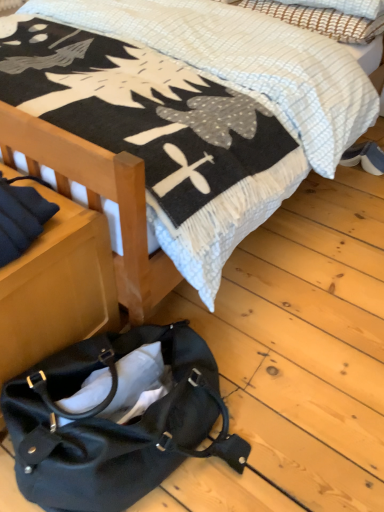
Question: From their relative heights in the image, would you say woven fabric pillow at upper right is taller or shorter than blue suede shoes at lower right?

Choices:
 (A) tall
 (B) short

Answer: (A)

Question: Considering their positions, is woven fabric pillow at upper right located in front of or behind blue suede shoes at lower right?

Choices:
 (A) behind
 (B) front

Answer: (B)

Question: Estimate the real-world distances between objects in this image. Which object is farther from the blue suede shoes at lower right?

Choices:
 (A) woven fabric pillow at upper right
 (B) soft cotton blanket at upper center
 (C) matte black handbag at lower left

Answer: (C)

Question: Based on their relative distances, which object is nearer to the woven fabric pillow at upper right?

Choices:
 (A) blue suede shoes at lower right
 (B) matte black handbag at lower left
 (C) soft cotton blanket at upper center

Answer: (C)